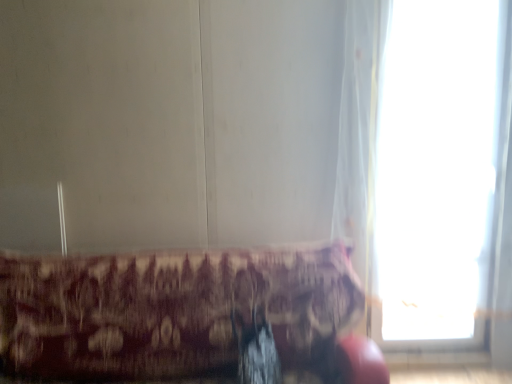
What do you see at coordinates (441, 170) in the screenshot?
I see `transparent glass window at right` at bounding box center [441, 170].

Identify the location of transparent glass window at right. This screenshot has width=512, height=384. (441, 170).

What is the approximate width of transparent glass window at right?

It is 11.37 centimeters.

Locate an element on the screen. patterned fabric cushion at lower center is located at coordinates (186, 317).

What do you see at coordinates (186, 317) in the screenshot? The width and height of the screenshot is (512, 384). I see `patterned fabric cushion at lower center` at bounding box center [186, 317].

In order to click on transparent glass window at right in this screenshot , I will do pyautogui.click(x=441, y=170).

Considering the positions of objects patterned fabric cushion at lower center and transparent glass window at right in the image provided, who is more to the left, patterned fabric cushion at lower center or transparent glass window at right?

From the viewer's perspective, patterned fabric cushion at lower center appears more on the left side.

Does patterned fabric cushion at lower center come in front of transparent glass window at right?

Yes, the depth of patterned fabric cushion at lower center is less than that of transparent glass window at right.

Between point (150, 311) and point (479, 13), which one is positioned behind?

The point (479, 13) is farther.

From the image's perspective, would you say patterned fabric cushion at lower center is positioned over transparent glass window at right?

No, from the image's perspective, patterned fabric cushion at lower center is not over transparent glass window at right.

From a real-world perspective, is patterned fabric cushion at lower center physically located above or below transparent glass window at right?

Clearly, from a real-world perspective, patterned fabric cushion at lower center is below transparent glass window at right.

From the picture: Which of these two, patterned fabric cushion at lower center or transparent glass window at right, is wider?

patterned fabric cushion at lower center.

Which of these two, patterned fabric cushion at lower center or transparent glass window at right, stands taller?

With more height is transparent glass window at right.

Is patterned fabric cushion at lower center bigger or smaller than transparent glass window at right?

Clearly, patterned fabric cushion at lower center is larger in size than transparent glass window at right.

From the picture: Is patterned fabric cushion at lower center inside or outside of transparent glass window at right?

patterned fabric cushion at lower center is not inside transparent glass window at right, it's outside.

Is patterned fabric cushion at lower center not near transparent glass window at right?

Absolutely, patterned fabric cushion at lower center is distant from transparent glass window at right.

Is patterned fabric cushion at lower center oriented away from transparent glass window at right?

No, patterned fabric cushion at lower center's orientation is not away from transparent glass window at right.

This screenshot has height=384, width=512. Identify the location of window that is above the patterned fabric cushion at lower center (from the image's perspective). (441, 170).

In the image, is transparent glass window at right on the left side or the right side of patterned fabric cushion at lower center?

Based on their positions, transparent glass window at right is located to the right of patterned fabric cushion at lower center.

Is transparent glass window at right closer to the viewer compared to patterned fabric cushion at lower center?

No, it is not.

Which is in front, point (455, 90) or point (339, 263)?

Positioned in front is point (339, 263).

From the image's perspective, is transparent glass window at right over patterned fabric cushion at lower center?

Yes, from the image's perspective, transparent glass window at right is over patterned fabric cushion at lower center.

From a real-world perspective, is transparent glass window at right below patterned fabric cushion at lower center?

Incorrect, from a real-world perspective, transparent glass window at right is higher than patterned fabric cushion at lower center.

Looking at this image, considering the sizes of objects transparent glass window at right and patterned fabric cushion at lower center in the image provided, who is wider, transparent glass window at right or patterned fabric cushion at lower center?

patterned fabric cushion at lower center.

Which of these two, transparent glass window at right or patterned fabric cushion at lower center, stands taller?

Standing taller between the two is transparent glass window at right.

Based on the photo, is transparent glass window at right bigger or smaller than patterned fabric cushion at lower center?

Clearly, transparent glass window at right is smaller in size than patterned fabric cushion at lower center.

Is transparent glass window at right completely or partially outside of patterned fabric cushion at lower center?

Indeed, transparent glass window at right is completely outside patterned fabric cushion at lower center.

Is there a large distance between transparent glass window at right and patterned fabric cushion at lower center?

Indeed, transparent glass window at right is not near patterned fabric cushion at lower center.

Is transparent glass window at right turned away from patterned fabric cushion at lower center?

No, transparent glass window at right is not facing away from patterned fabric cushion at lower center.

What are the coordinates of `furniture on the left of transparent glass window at right` in the screenshot? It's located at (186, 317).

You are a GUI agent. You are given a task and a screenshot of the screen. Output one action in this format:
    pyautogui.click(x=<x>, y=<y>)
    Task: Click on the window on the right of patterned fabric cushion at lower center
    This screenshot has height=384, width=512.
    Given the screenshot: What is the action you would take?
    pyautogui.click(x=441, y=170)

Where is `furniture lying in front of the transparent glass window at right`? furniture lying in front of the transparent glass window at right is located at coordinates (186, 317).